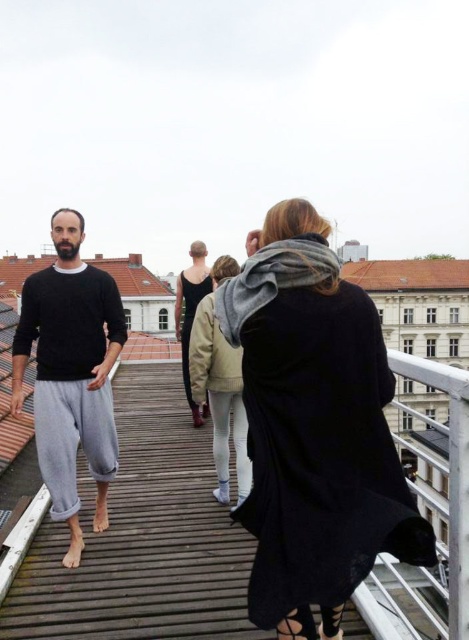
Question: Among these objects, which one is farthest from the camera?

Choices:
 (A) matte black roof at center
 (B) light beige sweater at center
 (C) black cotton sweater at left
 (D) brown tile roof at upper center

Answer: (A)

Question: Is black wool coat at center wider than matte black roof at center?

Choices:
 (A) no
 (B) yes

Answer: (A)

Question: Which object appears closest to the camera in this image?

Choices:
 (A) black matte dress at center
 (B) light beige sweater at center
 (C) black wool coat at center

Answer: (C)

Question: Which of the following is the farthest from the observer?

Choices:
 (A) (394, 276)
 (B) (378, 470)

Answer: (A)

Question: In this image, where is black wool coat at center located relative to black matte dress at center?

Choices:
 (A) left
 (B) right

Answer: (B)

Question: Does brown tile roof at upper center appear under black matte dress at center?

Choices:
 (A) no
 (B) yes

Answer: (A)